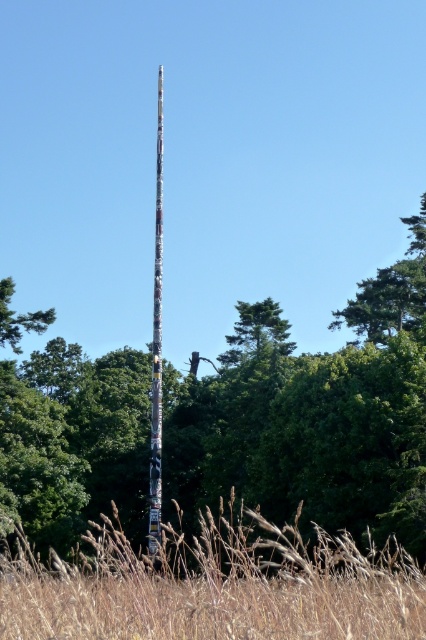
Consider the image. You are standing at the point labeled point (58, 374) and want to walk to the base of the totem pole. Given that the distance between them is 275.65 feet, can you estimate how long it would take you to walk there at a normal pace of 3 feet per second?

The distance between point (58, 374) and the totem pole is 275.65 feet. At a normal walking pace of 3 feet per second, it would take approximately 91.88 seconds, which is about 1 minute and 32 seconds, to reach the base of the totem pole.

You are standing in front of the totem pole and want to place a small flag at each of the two points marked. The first point is at coordinates point [17,564] and the second point is at coordinates point [155,502]. Which point is closer to you when you are facing the totem pole?

Point [17,564] is in front of point [155,502], so when facing the totem pole, the first point is closer to you.